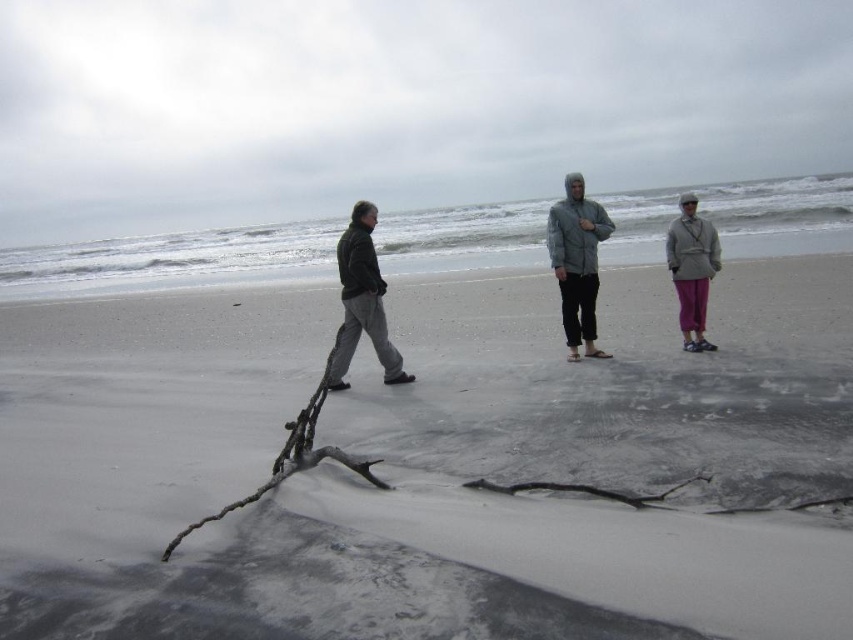
Which is above, gray woolen jacket at center or gray fabric jacket at center?

gray fabric jacket at center is higher up.

Is gray woolen jacket at center to the right of gray fabric jacket at center from the viewer's perspective?

In fact, gray woolen jacket at center is to the left of gray fabric jacket at center.

Find the location of `gray woolen jacket at center`. gray woolen jacket at center is located at coordinates (577, 262).

Can you confirm if gray woolen jacket at center is bigger than dark gray fabric jacket at left?

Incorrect, gray woolen jacket at center is not larger than dark gray fabric jacket at left.

Who is shorter, gray woolen jacket at center or dark gray fabric jacket at left?

With less height is gray woolen jacket at center.

Locate an element on the screen. The width and height of the screenshot is (853, 640). gray woolen jacket at center is located at coordinates (577, 262).

Does point (154, 420) come closer to viewer compared to point (676, 257)?

Yes, it is in front of point (676, 257).

Which is below, gray sand at center or gray soft jacket at center?

gray sand at center

The width and height of the screenshot is (853, 640). I want to click on gray sand at center, so (209, 490).

Find the location of a particular element. gray sand at center is located at coordinates (209, 490).